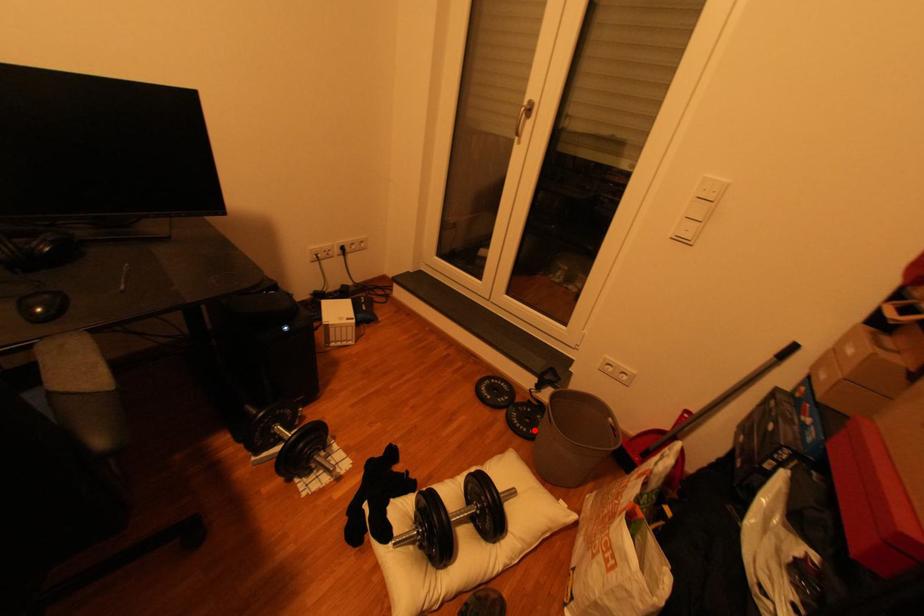
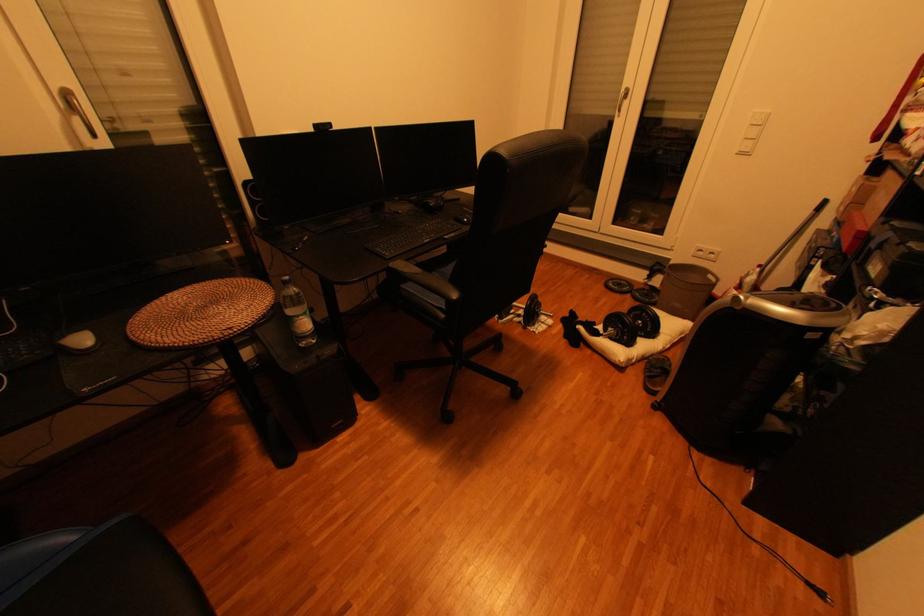
Question: A red point is marked in image1. In image2, is the corresponding 3D point closer to the camera or farther? Reply with the corresponding letter.

Choices:
 (A) The corresponding 3D point is closer.
 (B) The corresponding 3D point is farther.

Answer: (B)